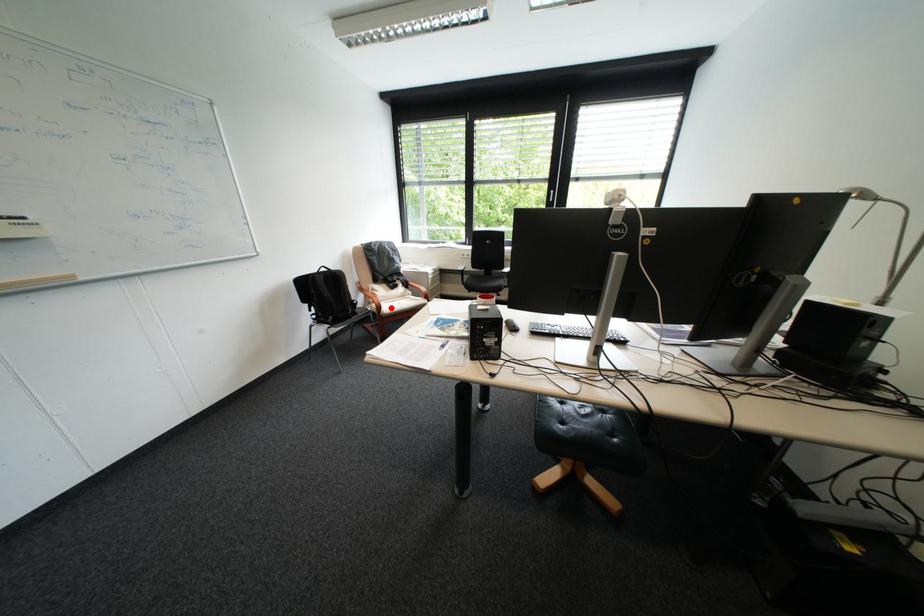
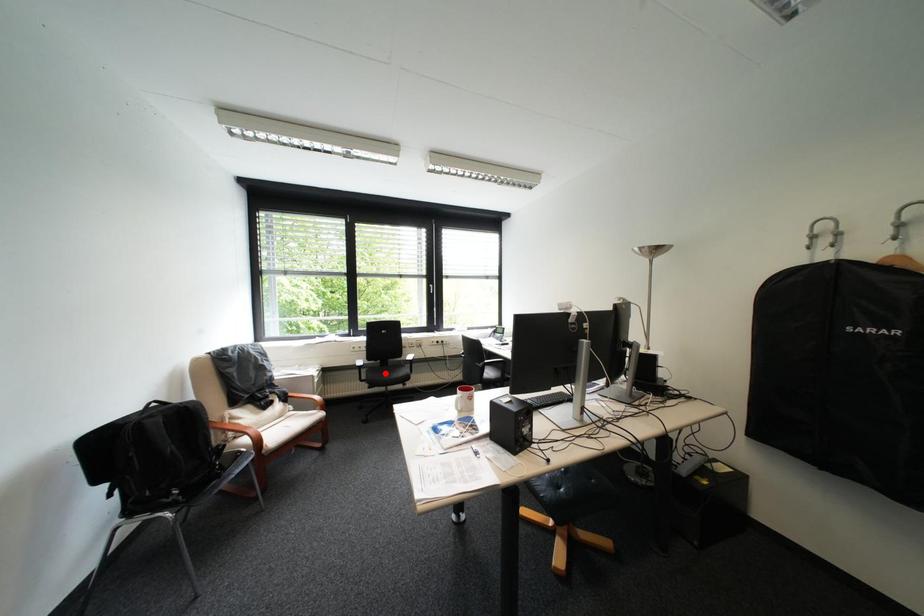
I am providing you with two images of the same scene from different viewpoints. A red point is marked on the first image and another point is marked on the second image. Is the marked point in image1 the same physical position as the marked point in image2?

No